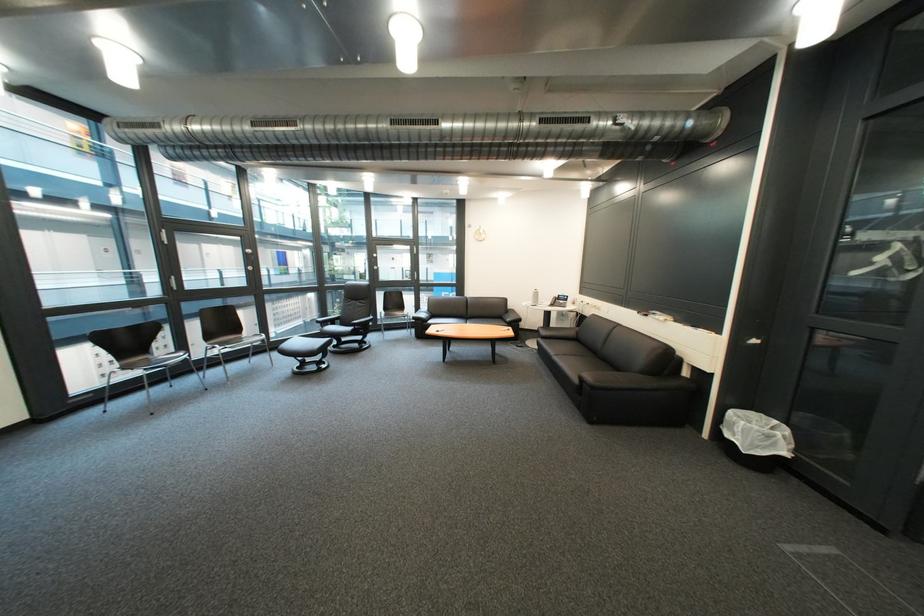
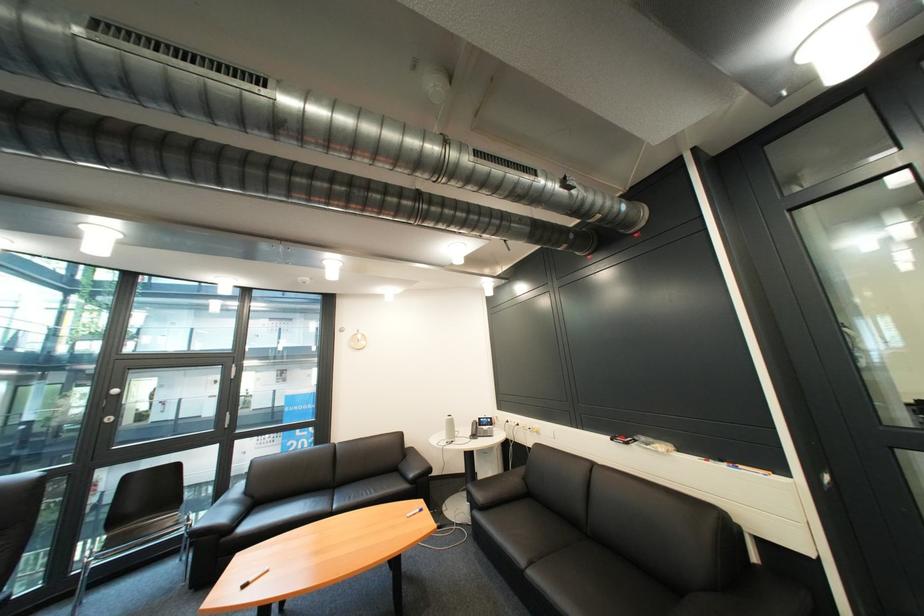
Where in the second image is the point corresponding to (x=444, y=315) from the first image?

(262, 503)